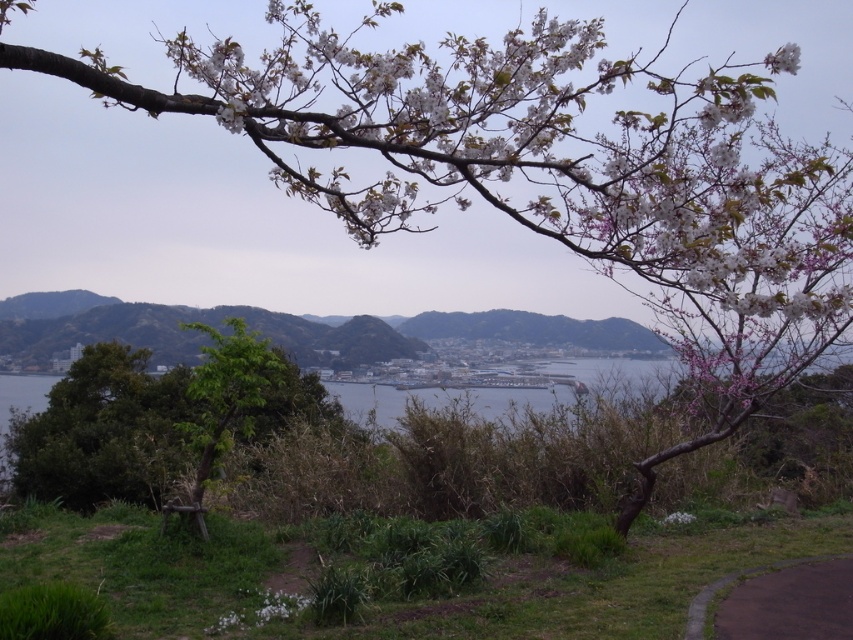
You are a hiker standing at the start of the paved asphalt path at lower right. Looking towards the green leafy tree at center, which direction should you walk to reach it?

The green leafy tree at center is to the left of the paved asphalt path at lower right, so you should walk towards the left direction to reach it.

You are a landscape architect designing a new garden. You have to place a large statue that requires a space wider than the green leafy tree at center. Can the white matte flower at upper right accommodate the statue instead?

The green leafy tree at center might be wider than the white matte flower at upper right, so the white matte flower at upper right may not be wide enough to accommodate the statue that needs more space than the green leafy tree at center.